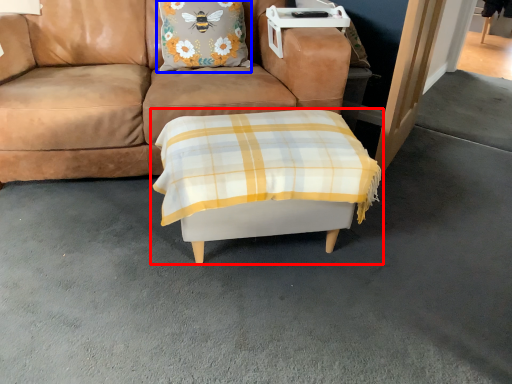
Question: Which object is further to the camera taking this photo, table (highlighted by a red box) or pillow (highlighted by a blue box)?

Choices:
 (A) table
 (B) pillow

Answer: (B)